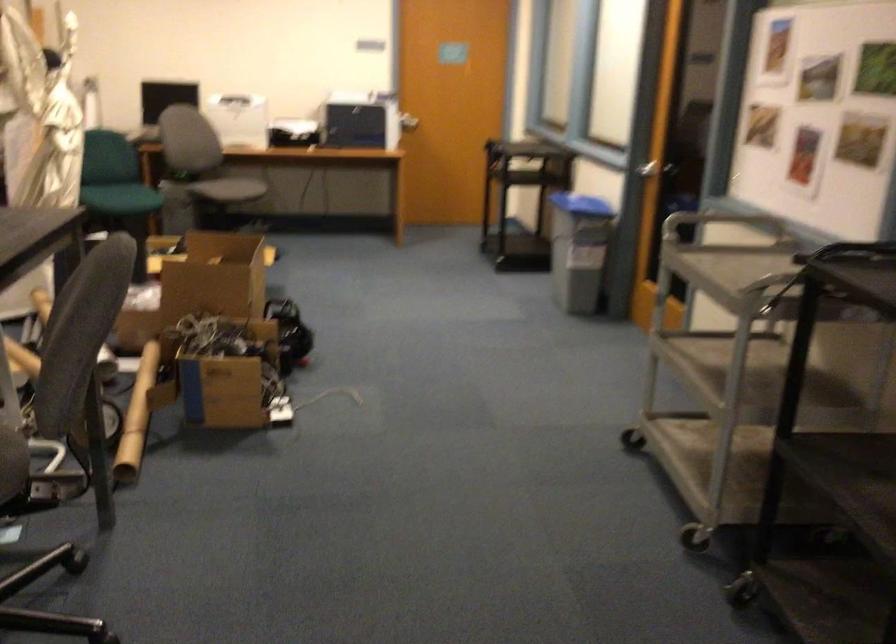
Find where to lift the cardboard tube. Please return your answer as a coordinate pair (x, y).

(136, 417)